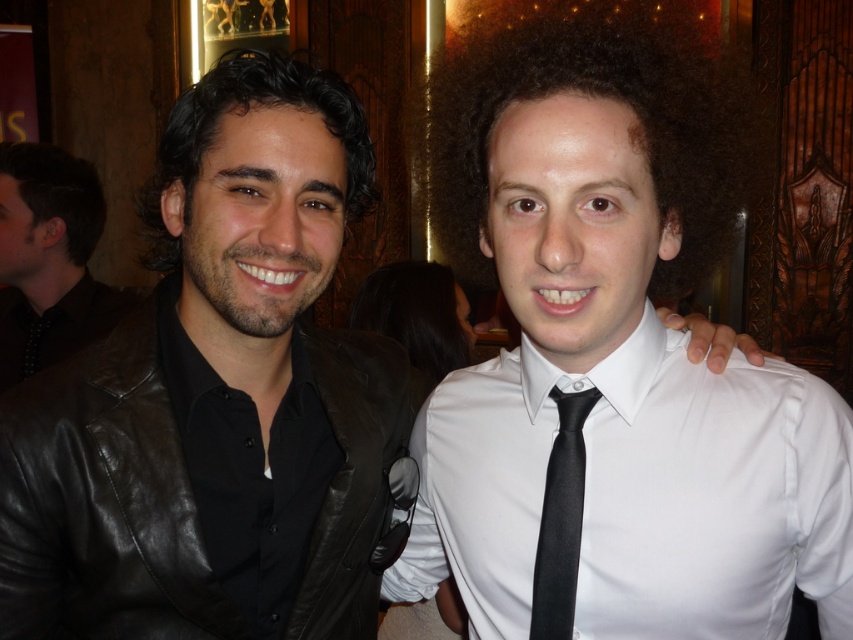
Question: Is white satin shirt at right closer to the viewer compared to black leather jacket at left?

Choices:
 (A) no
 (B) yes

Answer: (B)

Question: Can you confirm if black leather jacket at left is positioned below black satin tie at center?

Choices:
 (A) yes
 (B) no

Answer: (B)

Question: Which of these objects is positioned farthest from the black satin tie at center?

Choices:
 (A) black leather jacket at left
 (B) white satin shirt at right

Answer: (A)

Question: Which point is closer to the camera?

Choices:
 (A) (x=669, y=400)
 (B) (x=85, y=200)
 (C) (x=576, y=449)

Answer: (C)

Question: Is black leather jacket at left positioned behind matte black jacket at left?

Choices:
 (A) yes
 (B) no

Answer: (B)

Question: Estimate the real-world distances between objects in this image. Which object is closer to the white satin shirt at right?

Choices:
 (A) matte black jacket at left
 (B) black satin tie at center
 (C) black leather jacket at left

Answer: (B)